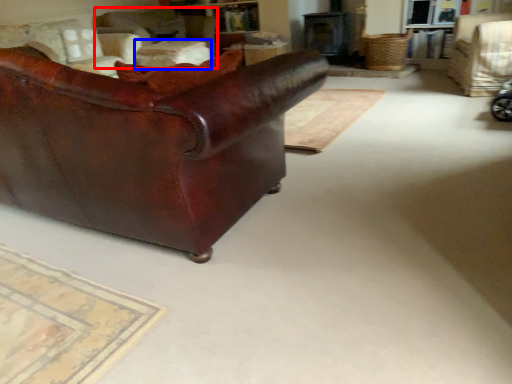
Question: Which object is further to the camera taking this photo, chair (highlighted by a red box) or table (highlighted by a blue box)?

Choices:
 (A) chair
 (B) table

Answer: (A)